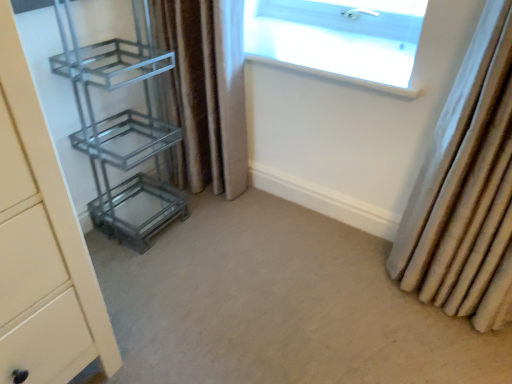
Question: Is beige carpet at center not within transparent glass window at upper center?

Choices:
 (A) no
 (B) yes

Answer: (B)

Question: Considering the relative sizes of beige carpet at center and transparent glass window at upper center in the image provided, is beige carpet at center thinner than transparent glass window at upper center?

Choices:
 (A) yes
 (B) no

Answer: (B)

Question: Would you say beige carpet at center is a long distance from transparent glass window at upper center?

Choices:
 (A) yes
 (B) no

Answer: (B)

Question: Does beige carpet at center have a greater height compared to transparent glass window at upper center?

Choices:
 (A) yes
 (B) no

Answer: (B)

Question: Is beige carpet at center oriented away from transparent glass window at upper center?

Choices:
 (A) yes
 (B) no

Answer: (B)

Question: From a real-world perspective, is beige carpet at center located higher than transparent glass window at upper center?

Choices:
 (A) yes
 (B) no

Answer: (B)

Question: Is transparent glass window at upper center next to brown textured curtain at center, the second curtain in the right-to-left sequence, and touching it?

Choices:
 (A) no
 (B) yes

Answer: (A)

Question: Considering the relative sizes of transparent glass window at upper center and brown textured curtain at center, the second curtain in the right-to-left sequence, in the image provided, is transparent glass window at upper center thinner than brown textured curtain at center, the second curtain in the right-to-left sequence,?

Choices:
 (A) yes
 (B) no

Answer: (B)

Question: Is transparent glass window at upper center outside brown textured curtain at center, the 1th curtain in the left-to-right sequence?

Choices:
 (A) no
 (B) yes

Answer: (B)

Question: Does transparent glass window at upper center have a greater width compared to brown textured curtain at center, the second curtain in the right-to-left sequence?

Choices:
 (A) yes
 (B) no

Answer: (A)

Question: Is transparent glass window at upper center shorter than brown textured curtain at center, the 1th curtain in the left-to-right sequence?

Choices:
 (A) yes
 (B) no

Answer: (A)

Question: From the image's perspective, would you say transparent glass window at upper center is positioned over brown textured curtain at center, the 1th curtain in the left-to-right sequence?

Choices:
 (A) yes
 (B) no

Answer: (A)

Question: Is beige carpet at center taller than metallic glass shelf at left?

Choices:
 (A) no
 (B) yes

Answer: (A)